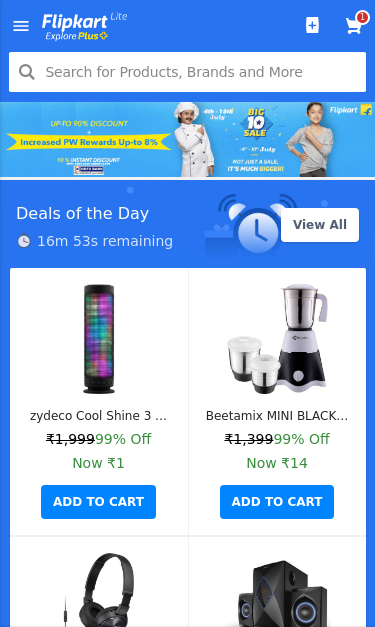
Locate an element on the screen. The height and width of the screenshot is (627, 375). speakers is located at coordinates (273, 579).